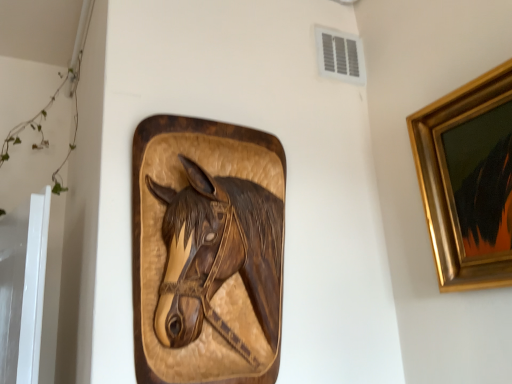
Question: Considering the relative positions of white plastic vent at upper center and gold-framed painting at upper right in the image provided, is white plastic vent at upper center to the left of gold-framed painting at upper right from the viewer's perspective?

Choices:
 (A) no
 (B) yes

Answer: (B)

Question: Is white plastic vent at upper center behind gold-framed painting at upper right?

Choices:
 (A) no
 (B) yes

Answer: (B)

Question: Can gold-framed painting at upper right be found inside white plastic vent at upper center?

Choices:
 (A) yes
 (B) no

Answer: (B)

Question: Is white plastic vent at upper center to the right of gold-framed painting at upper right from the viewer's perspective?

Choices:
 (A) yes
 (B) no

Answer: (B)

Question: From the image's perspective, is white plastic vent at upper center over gold-framed painting at upper right?

Choices:
 (A) no
 (B) yes

Answer: (B)

Question: Is wooden carved horse head at center taller or shorter than white plastic vent at upper center?

Choices:
 (A) short
 (B) tall

Answer: (B)

Question: Is wooden carved horse head at center inside or outside of white plastic vent at upper center?

Choices:
 (A) outside
 (B) inside

Answer: (A)

Question: From a real-world perspective, relative to white plastic vent at upper center, is wooden carved horse head at center vertically above or below?

Choices:
 (A) below
 (B) above

Answer: (A)

Question: Considering the positions of wooden carved horse head at center and white plastic vent at upper center in the image, is wooden carved horse head at center wider or thinner than white plastic vent at upper center?

Choices:
 (A) thin
 (B) wide

Answer: (B)

Question: In the image, is white plastic vent at upper center on the left side or the right side of gold-framed painting at upper right?

Choices:
 (A) left
 (B) right

Answer: (A)

Question: Based on their sizes in the image, would you say white plastic vent at upper center is bigger or smaller than gold-framed painting at upper right?

Choices:
 (A) small
 (B) big

Answer: (A)

Question: From a real-world perspective, relative to gold-framed painting at upper right, is white plastic vent at upper center vertically above or below?

Choices:
 (A) below
 (B) above

Answer: (B)

Question: From their relative heights in the image, would you say white plastic vent at upper center is taller or shorter than gold-framed painting at upper right?

Choices:
 (A) short
 (B) tall

Answer: (A)

Question: Is gold-framed painting at upper right to the left or to the right of wooden carved horse head at center in the image?

Choices:
 (A) left
 (B) right

Answer: (B)

Question: Considering the positions of gold-framed painting at upper right and wooden carved horse head at center in the image, is gold-framed painting at upper right bigger or smaller than wooden carved horse head at center?

Choices:
 (A) big
 (B) small

Answer: (B)